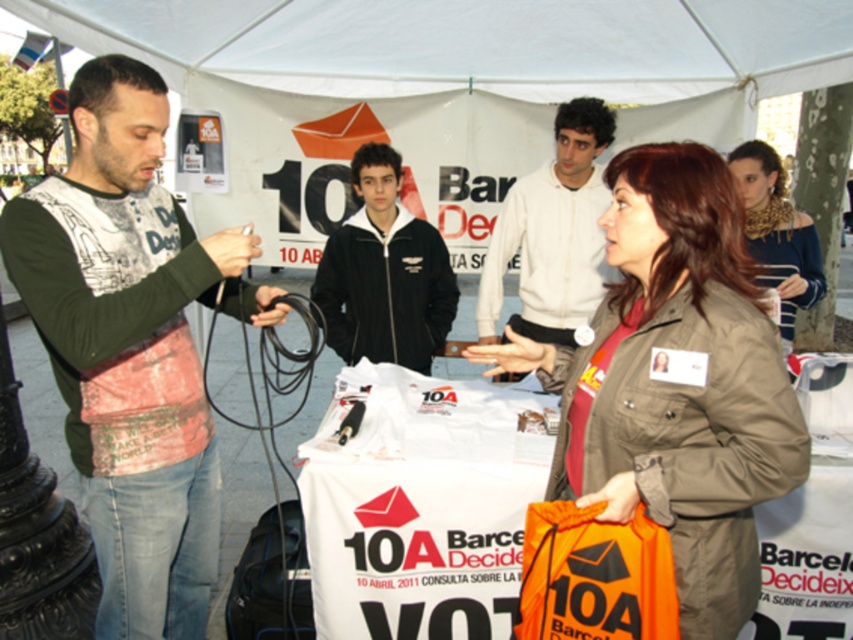
Who is positioned more to the right, matte khaki jacket at center or leopard print scarf at upper right?

Positioned to the right is leopard print scarf at upper right.

Is matte khaki jacket at center wider than leopard print scarf at upper right?

Correct, the width of matte khaki jacket at center exceeds that of leopard print scarf at upper right.

Where is `matte khaki jacket at center`? matte khaki jacket at center is located at coordinates (675, 381).

Which is more to the right, black fleece jacket at center or white cotton shirt at upper center?

white cotton shirt at upper center

Which is below, black fleece jacket at center or white cotton shirt at upper center?

black fleece jacket at center is lower down.

Measure the distance between point (x=361, y=259) and camera.

Point (x=361, y=259) is 3.39 meters away from camera.

This screenshot has width=853, height=640. I want to click on black fleece jacket at center, so click(x=384, y=273).

Which of these two, white cotton shirt at upper center or leopard print scarf at upper right, stands shorter?

leopard print scarf at upper right

I want to click on white cotton shirt at upper center, so click(x=553, y=234).